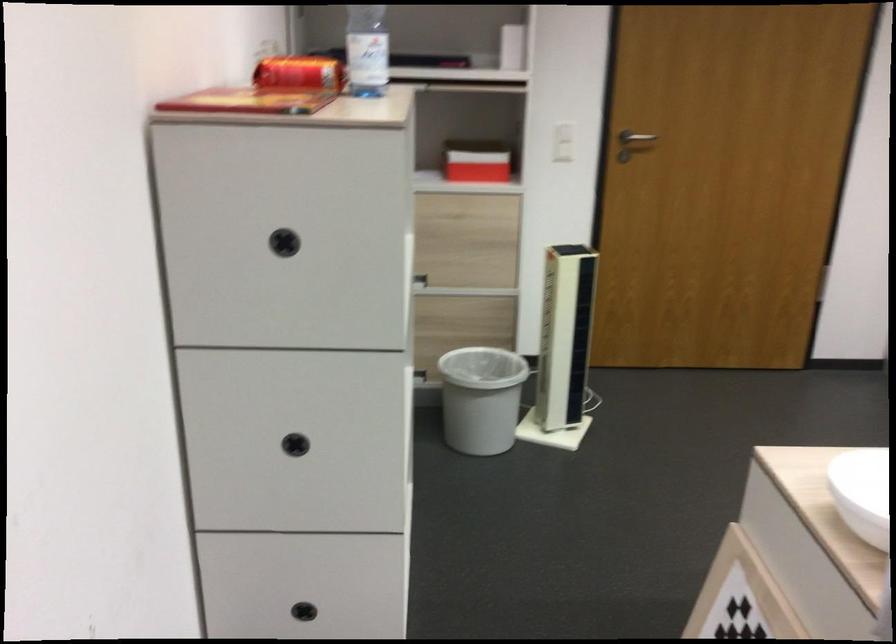
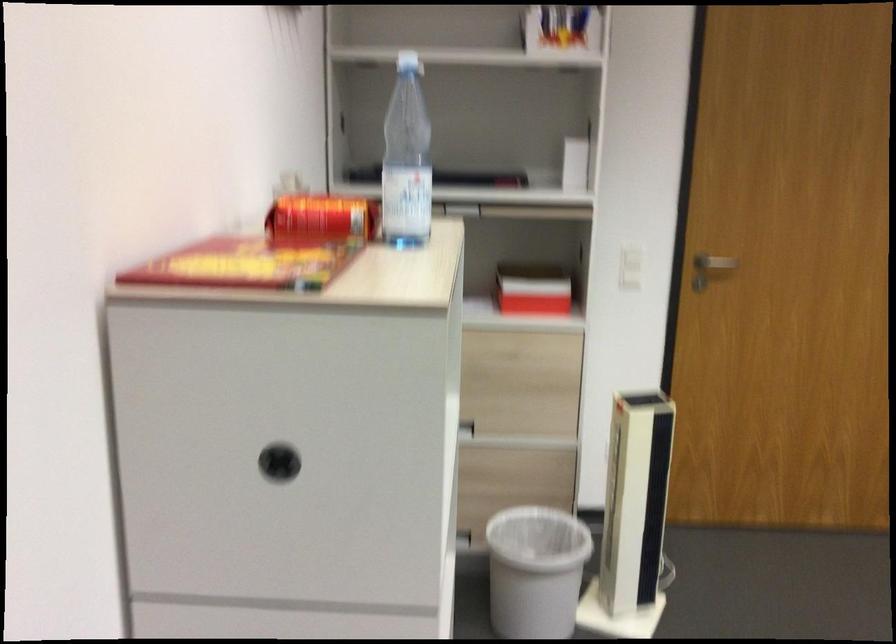
Question: Based on the continuous images, in which direction is the camera rotating? Reply with the corresponding letter.

Choices:
 (A) Left
 (B) Right
 (C) Up
 (D) Down

Answer: (C)